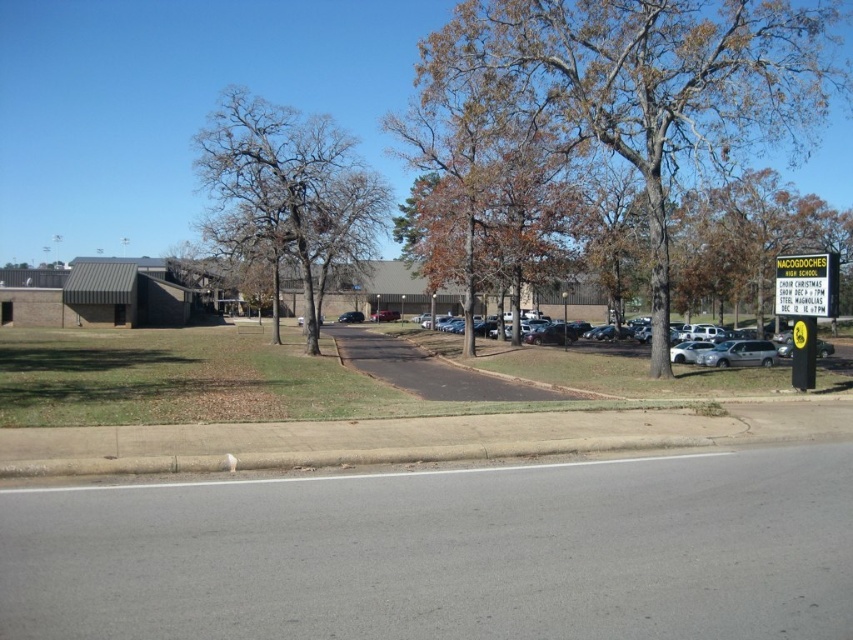
You are standing at the school entrance of Nacogdoches High School. You see a point marked at coordinate (635, 84). What does this point indicate?

The point at coordinate (635, 84) indicates a brown leafy tree at center.